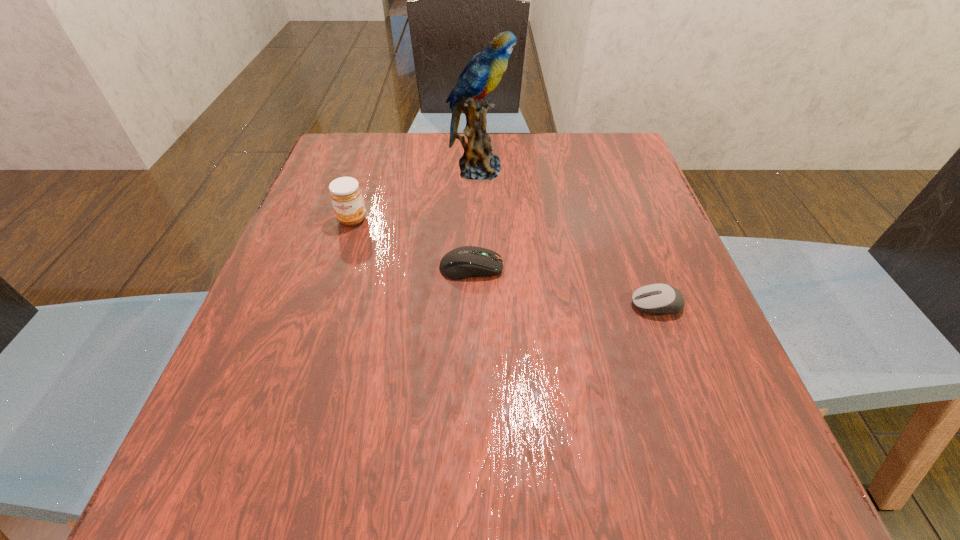
Where is `vacant area that lies between the rightmost object and the tallest object`? vacant area that lies between the rightmost object and the tallest object is located at coordinates (567, 237).

At what (x,y) coordinates should I click in order to perform the action: click on free space between the second tallest object and the nearer computer equipment. Please return your answer as a coordinate pair (x, y). Looking at the image, I should click on (504, 262).

Where is `free space between the second tallest object and the farthest object`? free space between the second tallest object and the farthest object is located at coordinates (416, 194).

This screenshot has width=960, height=540. In order to click on the closest object to the farthest object in this screenshot , I will do `click(345, 193)`.

Identify which object is the third closest to the farther computer equipment. Please provide its 2D coordinates. Your answer should be formatted as a tuple, i.e. [(x, y)], where the tuple contains the x and y coordinates of a point satisfying the conditions above.

[(482, 74)]

This screenshot has height=540, width=960. I want to click on vacant space that satisfies the following two spatial constraints: 1. on the face of the farthest object; 2. on the front label of the jam, so pos(478,219).

This screenshot has width=960, height=540. I want to click on vacant space that satisfies the following two spatial constraints: 1. on the face of the tallest object; 2. on the front label of the jam, so click(x=478, y=219).